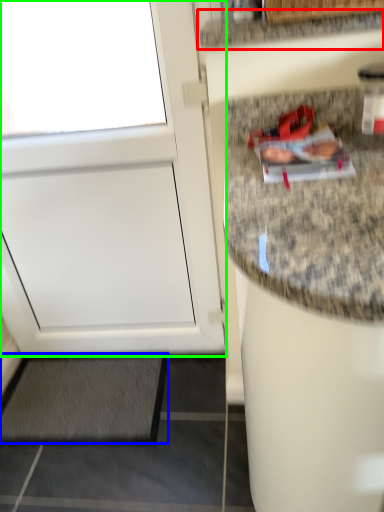
Question: Which object is positioned farthest from countertop (highlighted by a red box)? Select from mat (highlighted by a blue box) and door (highlighted by a green box).

Choices:
 (A) mat
 (B) door

Answer: (A)